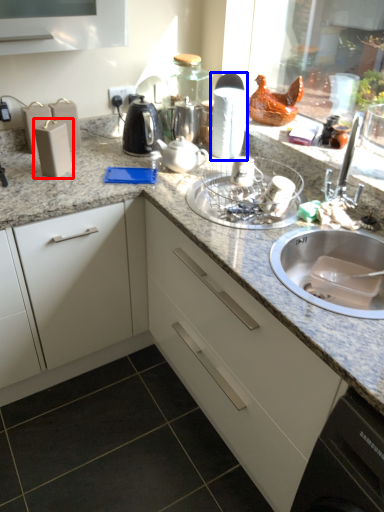
Question: Which object is further to the camera taking this photo, appliance (highlighted by a red box) or appliance (highlighted by a blue box)?

Choices:
 (A) appliance
 (B) appliance

Answer: (B)